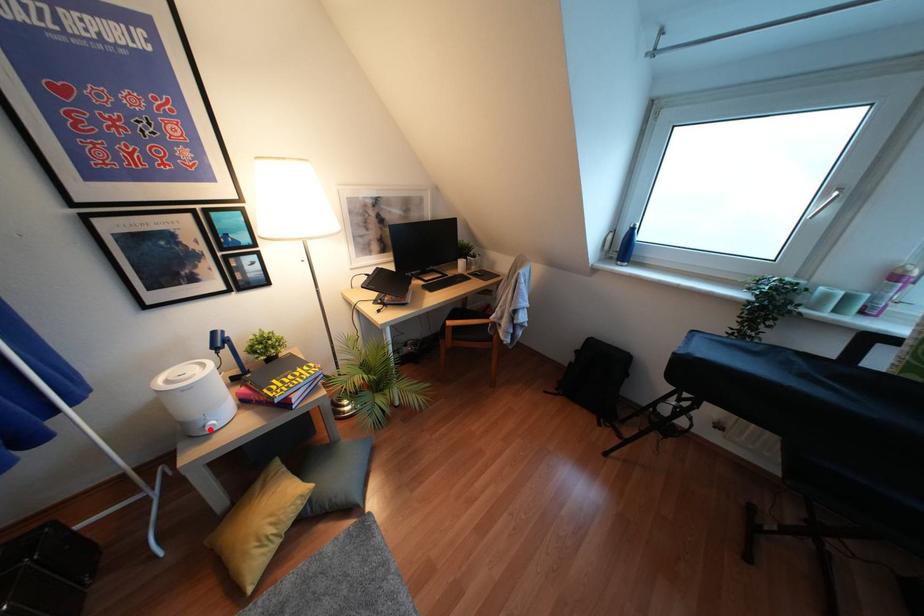
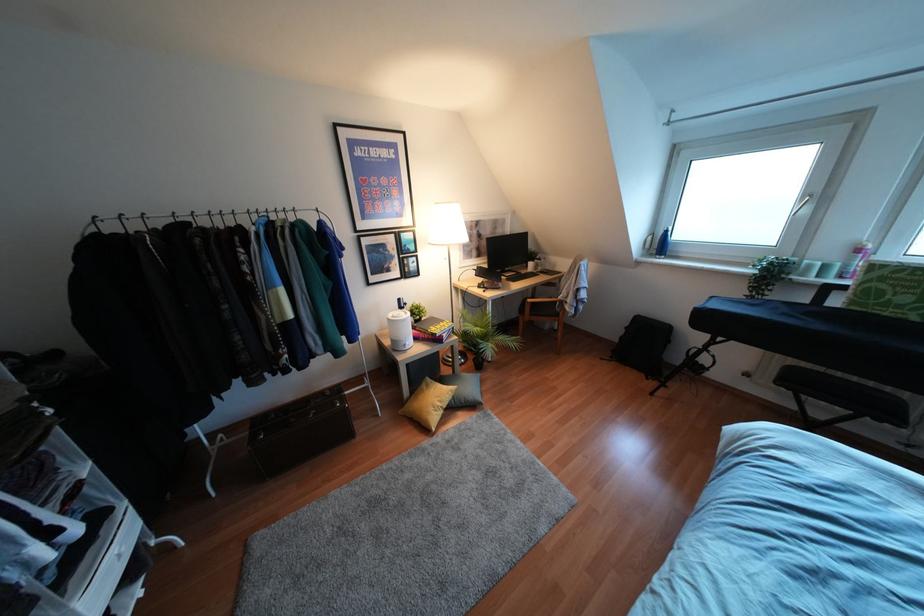
Find the pixel in the second image that matches the highlighted location in the first image.

(407, 347)